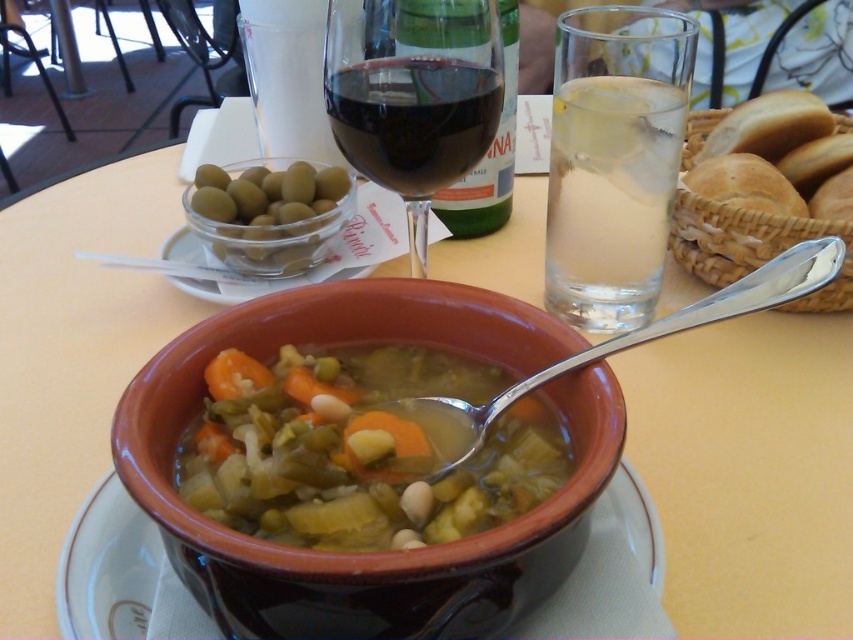
Does transparent glass wine glass at center appear over orange matte carrot at center?

Indeed, transparent glass wine glass at center is positioned over orange matte carrot at center.

Describe the element at coordinates (413, 96) in the screenshot. This screenshot has height=640, width=853. I see `transparent glass wine glass at center` at that location.

Which is in front, point (398, 132) or point (254, 387)?

Positioned in front is point (254, 387).

Image resolution: width=853 pixels, height=640 pixels. What are the coordinates of `transparent glass wine glass at center` in the screenshot? It's located at (413, 96).

What do you see at coordinates (413, 96) in the screenshot? The height and width of the screenshot is (640, 853). I see `transparent glass wine glass at center` at bounding box center [413, 96].

Between transparent glass wine glass at center and clear glass water at upper right, which one has more height?

With more height is clear glass water at upper right.

Does point (454, 150) come closer to viewer compared to point (593, 166)?

Yes, it is in front of point (593, 166).

You are a GUI agent. You are given a task and a screenshot of the screen. Output one action in this format:
    pyautogui.click(x=<x>, y=<y>)
    Task: Click on the transparent glass wine glass at center
    The image size is (853, 640).
    Given the screenshot: What is the action you would take?
    pyautogui.click(x=413, y=96)

Who is taller, transparent glass wine glass at center or silver metallic spoon at center?

transparent glass wine glass at center is taller.

Who is more distant from viewer, (386, 44) or (480, 410)?

Point (386, 44)

Measure the distance between point (389, 54) and camera.

Point (389, 54) and camera are 10.25 inches apart.

Locate an element on the screen. Image resolution: width=853 pixels, height=640 pixels. transparent glass wine glass at center is located at coordinates (413, 96).